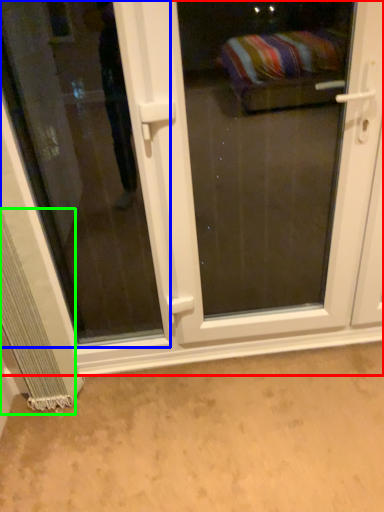
Question: Estimate the real-world distances between objects in this image. Which object is farther from door (highlighted by a red box), window (highlighted by a blue box) or curtain (highlighted by a green box)?

Choices:
 (A) window
 (B) curtain

Answer: (B)